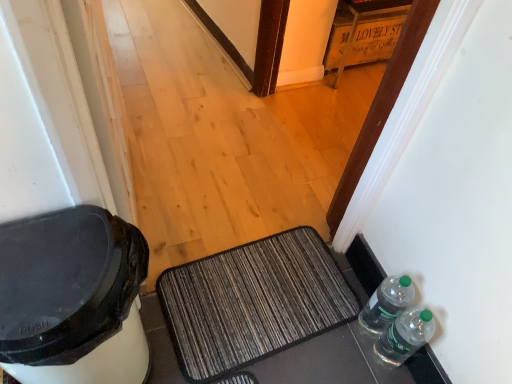
Question: Does textured gray doormat at center have a greater width compared to clear plastic bottles at lower right, which appears as the 2th bottle when viewed from the front?

Choices:
 (A) yes
 (B) no

Answer: (A)

Question: Is there a large distance between textured gray doormat at center and clear plastic bottles at lower right, which ranks as the first bottle in back-to-front order?

Choices:
 (A) no
 (B) yes

Answer: (A)

Question: Does textured gray doormat at center come in front of clear plastic bottles at lower right, which appears as the 2th bottle when viewed from the front?

Choices:
 (A) no
 (B) yes

Answer: (A)

Question: Is clear plastic bottles at lower right, which appears as the 2th bottle when viewed from the front, at the back of textured gray doormat at center?

Choices:
 (A) no
 (B) yes

Answer: (A)

Question: From a real-world perspective, is textured gray doormat at center physically above clear plastic bottles at lower right, which appears as the 2th bottle when viewed from the front?

Choices:
 (A) no
 (B) yes

Answer: (A)

Question: From the image's perspective, does textured gray doormat at center appear higher than clear plastic bottles at lower right, which ranks as the first bottle in back-to-front order?

Choices:
 (A) no
 (B) yes

Answer: (A)

Question: From a real-world perspective, is clear plastic bottles at lower right, which appears as the 2th bottle when viewed from the front, located beneath wooden crate at upper center?

Choices:
 (A) no
 (B) yes

Answer: (A)

Question: Does clear plastic bottles at lower right, which appears as the 2th bottle when viewed from the front, touch wooden crate at upper center?

Choices:
 (A) no
 (B) yes

Answer: (A)

Question: Are clear plastic bottles at lower right, which appears as the 2th bottle when viewed from the front, and wooden crate at upper center located far from each other?

Choices:
 (A) yes
 (B) no

Answer: (A)

Question: Considering the relative positions of clear plastic bottles at lower right, which ranks as the first bottle in back-to-front order, and wooden crate at upper center in the image provided, is clear plastic bottles at lower right, which ranks as the first bottle in back-to-front order, to the right of wooden crate at upper center from the viewer's perspective?

Choices:
 (A) no
 (B) yes

Answer: (A)

Question: Is clear plastic bottles at lower right, which ranks as the first bottle in back-to-front order, wider than wooden crate at upper center?

Choices:
 (A) no
 (B) yes

Answer: (A)

Question: Is clear plastic bottles at lower right, which appears as the 2th bottle when viewed from the front, turned away from wooden crate at upper center?

Choices:
 (A) no
 (B) yes

Answer: (A)

Question: From a real-world perspective, is wooden crate at upper center on top of clear plastic bottles at lower right, the second bottle viewed from the back?

Choices:
 (A) yes
 (B) no

Answer: (B)